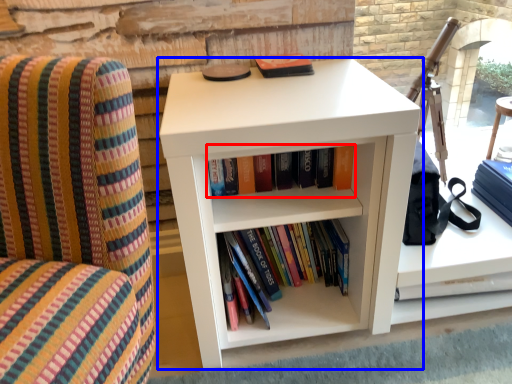
Question: Which of the following is the closest to the observer, book (highlighted by a red box) or shelf (highlighted by a blue box)?

Choices:
 (A) book
 (B) shelf

Answer: (B)